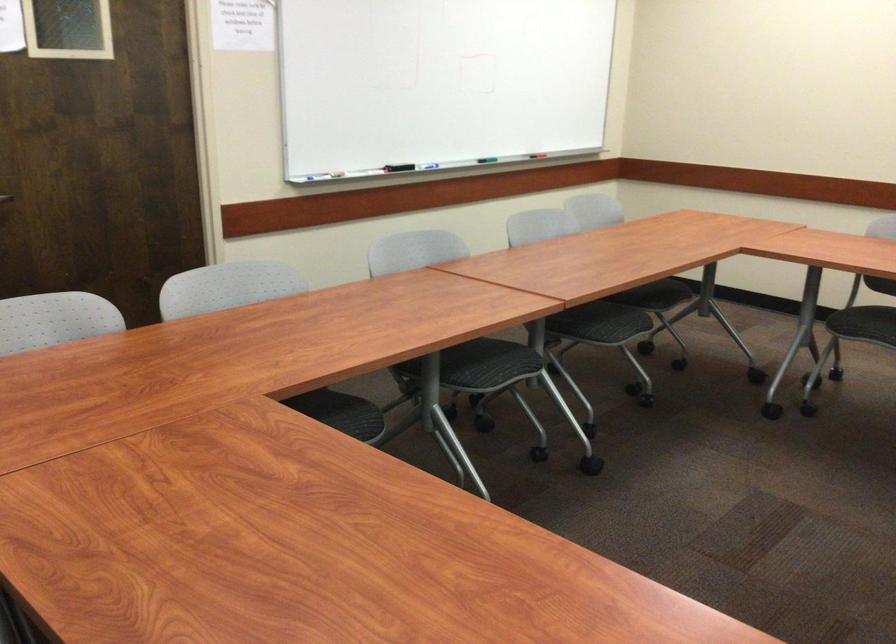
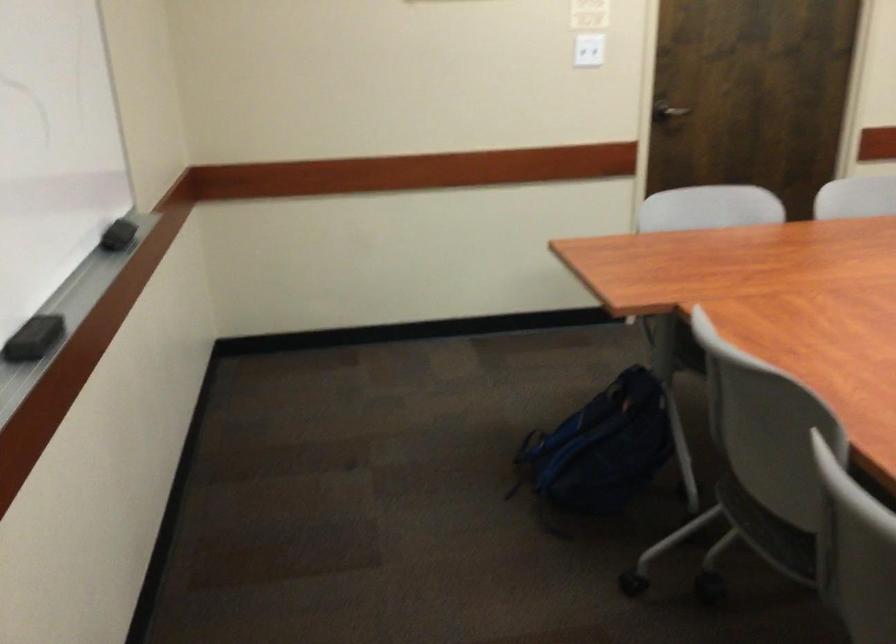
Question: The first image is from the beginning of the video and the second image is from the end. How did the camera likely rotate when shooting the video?

Choices:
 (A) Left
 (B) Right
 (C) Up
 (D) Down

Answer: (A)